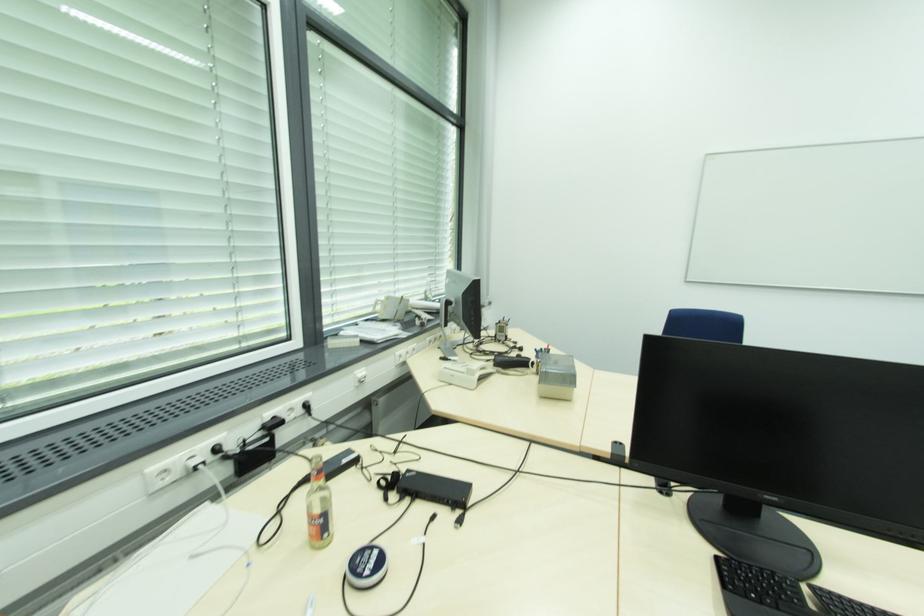
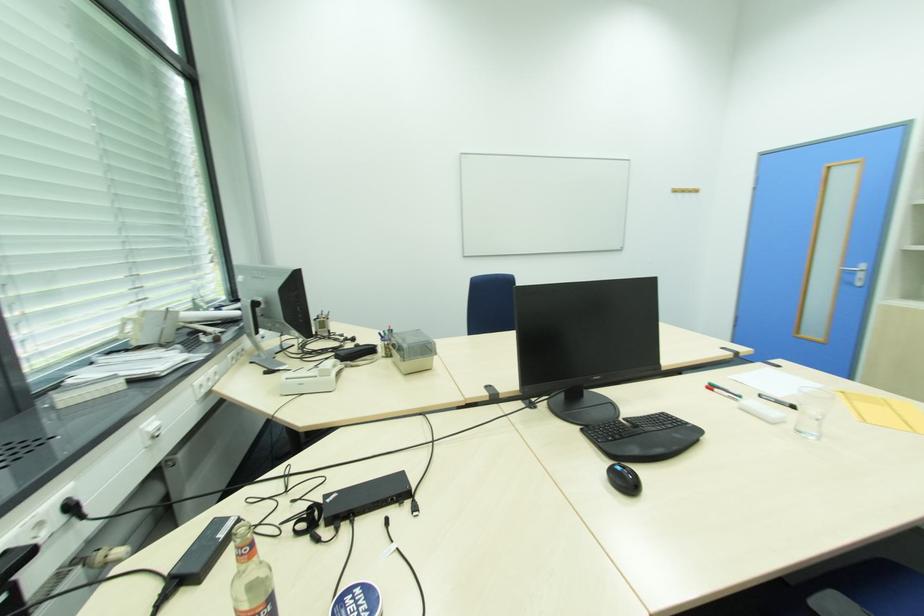
Question: The images are taken continuously from a first-person perspective. In which direction is your viewpoint rotating?

Choices:
 (A) Left
 (B) Right
 (C) Up
 (D) Down

Answer: (B)